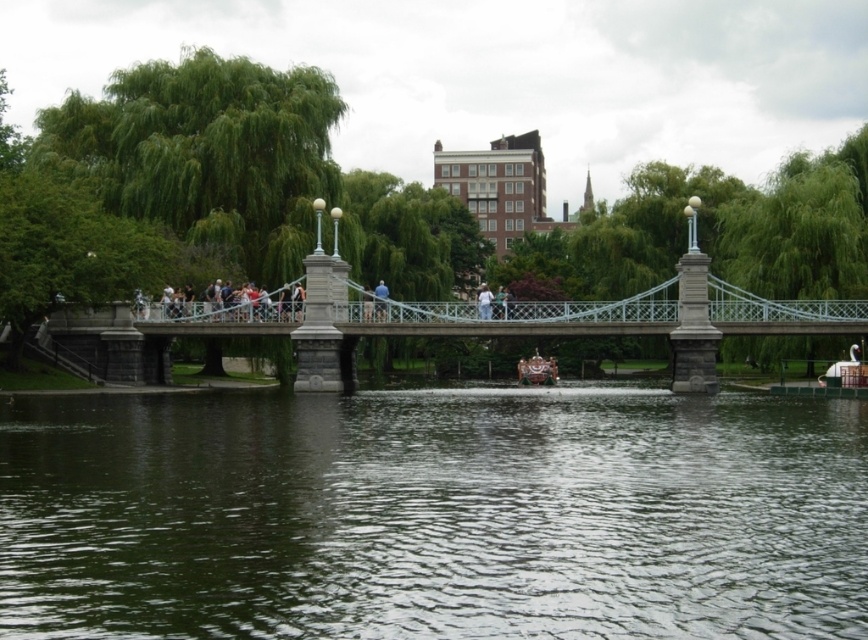
Question: Does green leafy tree at upper center appear over white cotton shirt at center?

Choices:
 (A) yes
 (B) no

Answer: (A)

Question: Which is nearer to the metallic gray bridge at center?

Choices:
 (A) light blue jeans at center
 (B) white cotton shirt at center
 (C) green leafy tree at upper center

Answer: (A)

Question: Which point is farther to the camera?

Choices:
 (A) metallic gray bridge at center
 (B) light blue jeans at center

Answer: (B)

Question: Which object is farther from the camera taking this photo?

Choices:
 (A) white cotton shirt at center
 (B) green leafy tree at upper center
 (C) light blue jeans at center

Answer: (C)

Question: Does green leafy tree at upper center come behind white cotton shirt at center?

Choices:
 (A) yes
 (B) no

Answer: (B)

Question: Does metallic gray bridge at center appear on the right side of light blue jeans at center?

Choices:
 (A) yes
 (B) no

Answer: (A)